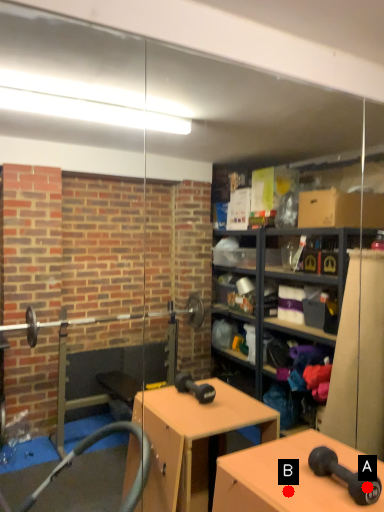
Question: Two points are circled on the image, labeled by A and B beside each circle. Which of the following is the closest to the observer?

Choices:
 (A) A is closer
 (B) B is closer

Answer: (A)